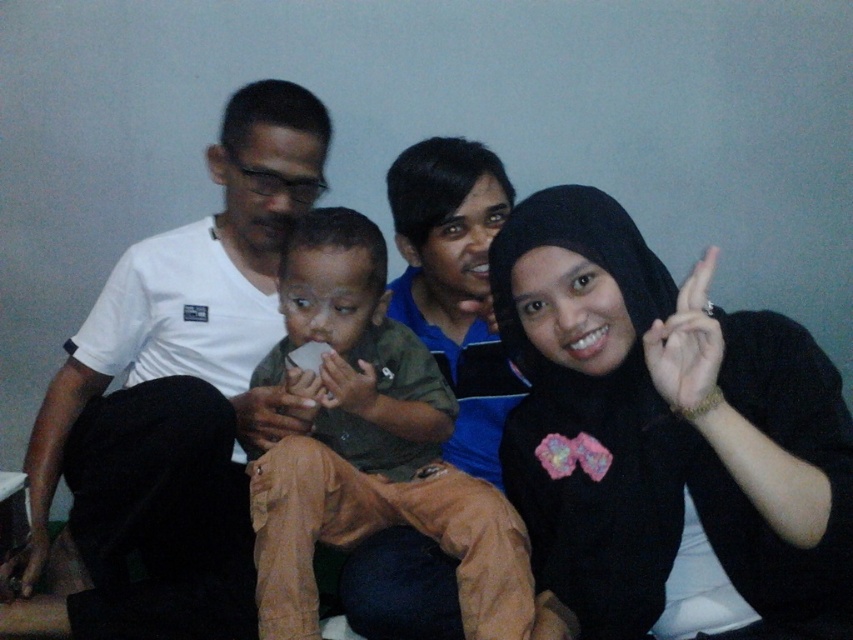
Question: Does black matte hijab at right come behind white matte t-shirt at left?

Choices:
 (A) yes
 (B) no

Answer: (B)

Question: Can you confirm if black matte hijab at right is positioned below brown cotton shirt at center?

Choices:
 (A) yes
 (B) no

Answer: (A)

Question: Can you confirm if black matte hijab at right is smaller than white matte t-shirt at left?

Choices:
 (A) yes
 (B) no

Answer: (A)

Question: Which object is farther from the camera taking this photo?

Choices:
 (A) brown cotton shirt at center
 (B) white matte t-shirt at left

Answer: (B)

Question: Which point is farther to the camera?

Choices:
 (A) brown cotton shirt at center
 (B) white matte t-shirt at left
 (C) black matte hijab at right

Answer: (B)

Question: Which object is positioned farthest from the brown cotton shirt at center?

Choices:
 (A) white matte t-shirt at left
 (B) black matte hijab at right

Answer: (B)